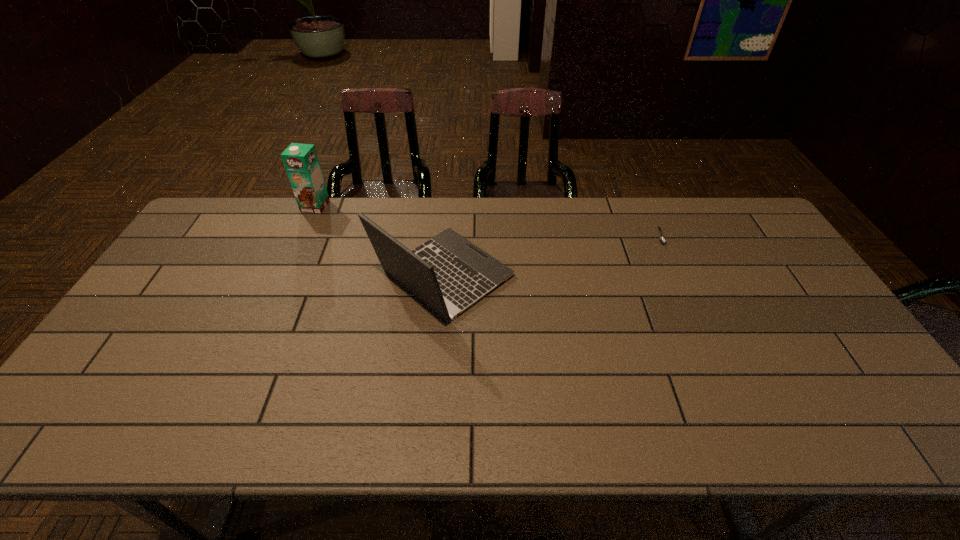
Locate an element on the screen. Image resolution: width=960 pixels, height=540 pixels. vacant area that lies between the laptop_computer and the soupspoon is located at coordinates (552, 256).

Locate an element on the screen. The image size is (960, 540). free spot between the soupspoon and the laptop_computer is located at coordinates (552, 256).

At what (x,y) coordinates should I click in order to perform the action: click on unoccupied position between the second object from right to left and the shortest object. Please return your answer as a coordinate pair (x, y). This screenshot has width=960, height=540. Looking at the image, I should click on (552, 256).

Find the location of a particular element. empty space between the carton and the soupspoon is located at coordinates (488, 221).

This screenshot has height=540, width=960. Identify the location of free space between the laptop_computer and the rightmost object. (552, 256).

Identify the location of object identified as the closest to the laptop_computer. The width and height of the screenshot is (960, 540). (301, 162).

The width and height of the screenshot is (960, 540). Identify the location of object that can be found as the closest to the shortest object. (448, 273).

Identify the location of free point that satisfies the following two spatial constraints: 1. on the front side of the rightmost object; 2. on the left side of the farthest object. The image size is (960, 540). (302, 236).

This screenshot has height=540, width=960. Find the location of `free location that satisfies the following two spatial constraints: 1. on the front side of the shortest object; 2. at the front screen of the laptop_computer`. free location that satisfies the following two spatial constraints: 1. on the front side of the shortest object; 2. at the front screen of the laptop_computer is located at coordinates (678, 276).

Locate an element on the screen. This screenshot has height=540, width=960. free space that satisfies the following two spatial constraints: 1. on the front side of the leftmost object; 2. on the right side of the rightmost object is located at coordinates (302, 236).